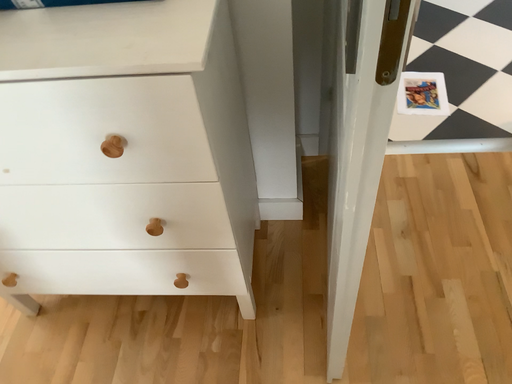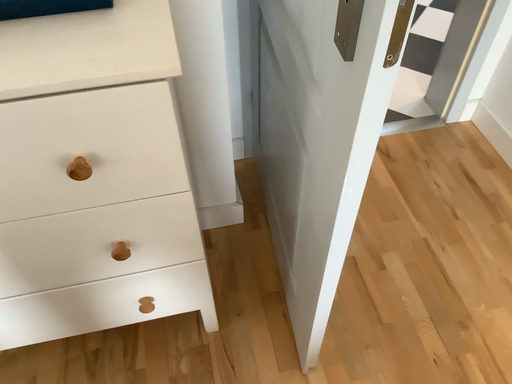
Question: How did the camera likely rotate when shooting the video?

Choices:
 (A) rotated right
 (B) rotated left

Answer: (A)